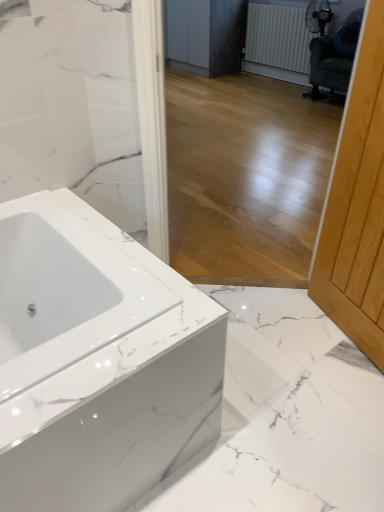
Question: Is white textured radiator at upper right not inside light wood screen door at right?

Choices:
 (A) no
 (B) yes

Answer: (B)

Question: From a real-world perspective, is white textured radiator at upper right on light wood screen door at right?

Choices:
 (A) no
 (B) yes

Answer: (A)

Question: Is white textured radiator at upper right positioned with its back to light wood screen door at right?

Choices:
 (A) no
 (B) yes

Answer: (A)

Question: Does white textured radiator at upper right have a greater width compared to light wood screen door at right?

Choices:
 (A) yes
 (B) no

Answer: (B)

Question: From the image's perspective, is white textured radiator at upper right above light wood screen door at right?

Choices:
 (A) no
 (B) yes

Answer: (B)

Question: Would you say light wood screen door at right is to the left or to the right of white glossy bathtub at lower left in the picture?

Choices:
 (A) left
 (B) right

Answer: (B)

Question: From a real-world perspective, is light wood screen door at right above or below white glossy bathtub at lower left?

Choices:
 (A) above
 (B) below

Answer: (A)

Question: Is light wood screen door at right taller or shorter than white glossy bathtub at lower left?

Choices:
 (A) tall
 (B) short

Answer: (A)

Question: Considering the positions of point (365, 102) and point (1, 440), is point (365, 102) closer or farther from the camera than point (1, 440)?

Choices:
 (A) closer
 (B) farther

Answer: (B)

Question: From the image's perspective, is light wood screen door at right above or below matte gray cabinetry at center?

Choices:
 (A) below
 (B) above

Answer: (A)

Question: Is light wood screen door at right wider or thinner than matte gray cabinetry at center?

Choices:
 (A) thin
 (B) wide

Answer: (A)

Question: Considering the positions of point (380, 224) and point (231, 1), is point (380, 224) closer or farther from the camera than point (231, 1)?

Choices:
 (A) farther
 (B) closer

Answer: (B)

Question: Is light wood screen door at right spatially inside matte gray cabinetry at center, or outside of it?

Choices:
 (A) inside
 (B) outside

Answer: (B)

Question: From a real-world perspective, is light wood screen door at right physically located above or below dark green fabric swivel chair at upper right?

Choices:
 (A) below
 (B) above

Answer: (B)

Question: From the image's perspective, is light wood screen door at right above or below dark green fabric swivel chair at upper right?

Choices:
 (A) above
 (B) below

Answer: (B)